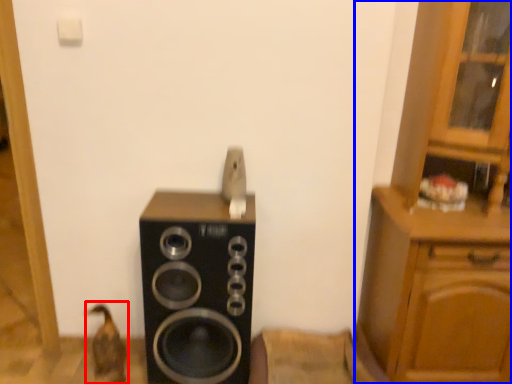
Question: Which point is closer to the camera, animal (highlighted by a red box) or cabinetry (highlighted by a blue box)?

Choices:
 (A) animal
 (B) cabinetry

Answer: (B)